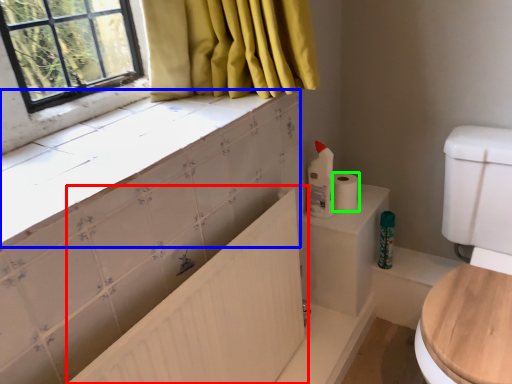
Question: Which is farther away from bath (highlighted by a red box)? counter top (highlighted by a blue box) or toilet paper (highlighted by a green box)?

Choices:
 (A) counter top
 (B) toilet paper

Answer: (B)